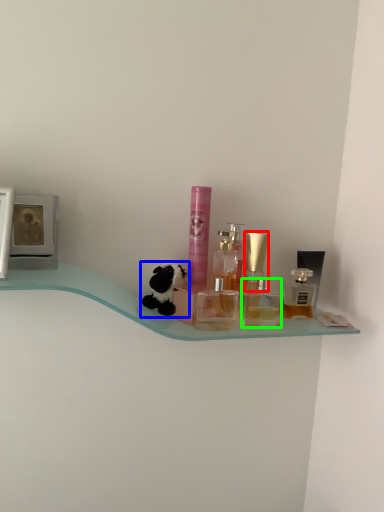
Question: Which object is positioned farthest from perfume (highlighted by a red box)? Select from toy (highlighted by a blue box) and toiletry (highlighted by a green box).

Choices:
 (A) toy
 (B) toiletry

Answer: (A)